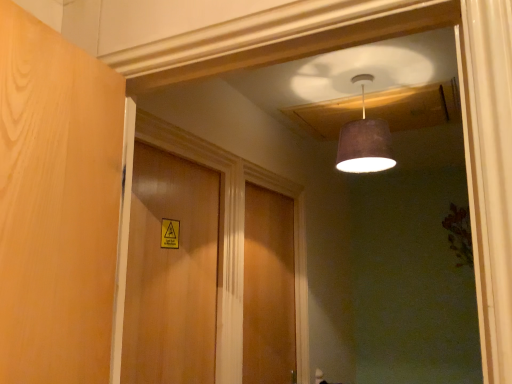
Question: Does wooden door at center, acting as the 2th door starting from the back, come in front of wooden door at center, placed as the first door when sorted from back to front?

Choices:
 (A) no
 (B) yes

Answer: (B)

Question: Does wooden door at center, placed as the second door when sorted from right to left, have a lesser height compared to wooden door at center, the first door in the right-to-left sequence?

Choices:
 (A) no
 (B) yes

Answer: (B)

Question: From the image's perspective, is wooden door at center, placed as the second door when sorted from right to left, on top of wooden door at center, arranged as the second door when viewed from the left?

Choices:
 (A) no
 (B) yes

Answer: (B)

Question: Considering the relative positions of wooden door at center, the first door viewed from the left, and wooden door at center, the first door in the right-to-left sequence, in the image provided, is wooden door at center, the first door viewed from the left, to the left of wooden door at center, the first door in the right-to-left sequence, from the viewer's perspective?

Choices:
 (A) yes
 (B) no

Answer: (A)

Question: Would you say wooden door at center, the first door viewed from the left, is outside wooden door at center, the first door in the right-to-left sequence?

Choices:
 (A) no
 (B) yes

Answer: (B)

Question: Considering the relative sizes of wooden door at center, arranged as the second door when viewed from the left, and wooden door at center, acting as the 2th door starting from the back, in the image provided, is wooden door at center, arranged as the second door when viewed from the left, smaller than wooden door at center, acting as the 2th door starting from the back,?

Choices:
 (A) yes
 (B) no

Answer: (B)

Question: From a real-world perspective, is wooden door at center, the 2th door from the front, positioned under wooden door at center, the first door positioned from the front, based on gravity?

Choices:
 (A) yes
 (B) no

Answer: (A)

Question: From the image's perspective, is wooden door at center, the 2th door from the front, on top of wooden door at center, the first door viewed from the left?

Choices:
 (A) no
 (B) yes

Answer: (A)

Question: Could you tell me if wooden door at center, the 2th door from the front, is turned towards wooden door at center, the first door viewed from the left?

Choices:
 (A) no
 (B) yes

Answer: (A)

Question: Considering the relative sizes of wooden door at center, the first door in the right-to-left sequence, and wooden door at center, the first door positioned from the front, in the image provided, is wooden door at center, the first door in the right-to-left sequence, taller than wooden door at center, the first door positioned from the front,?

Choices:
 (A) yes
 (B) no

Answer: (A)

Question: Is wooden door at center, placed as the first door when sorted from back to front, far from wooden door at center, the first door positioned from the front?

Choices:
 (A) no
 (B) yes

Answer: (A)

Question: Is wooden door at center, arranged as the second door when viewed from the left, far from matte brown lampshade at upper center?

Choices:
 (A) no
 (B) yes

Answer: (A)